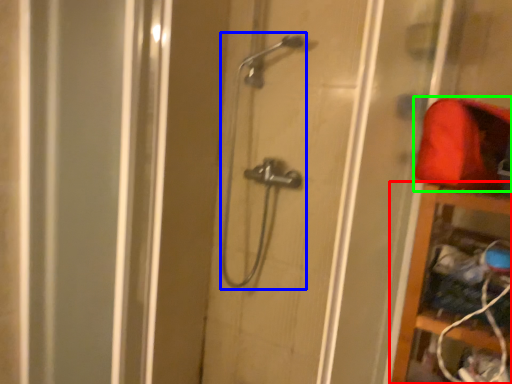
Question: Considering the real-world distances, which object is closest to cabinet (highlighted by a red box)? shower (highlighted by a blue box) or material (highlighted by a green box).

Choices:
 (A) shower
 (B) material

Answer: (B)